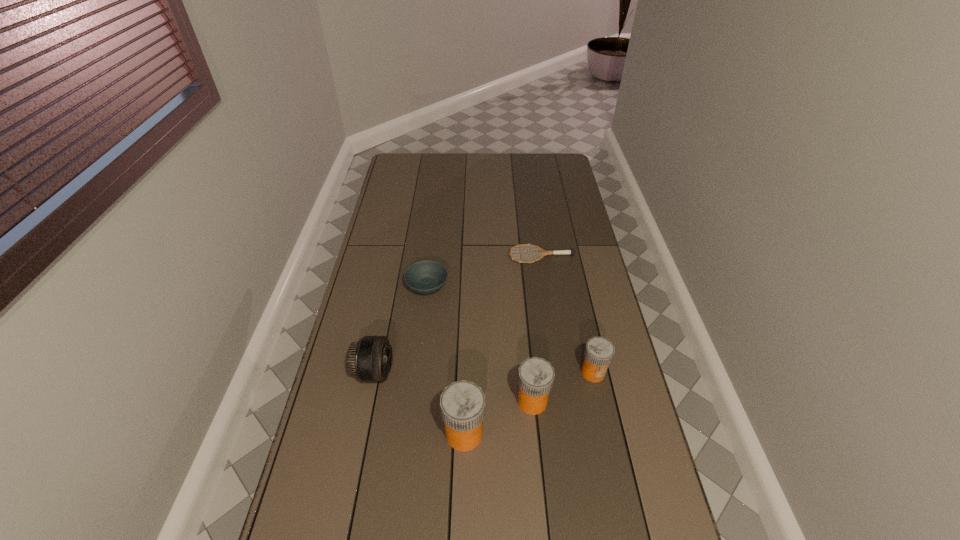
Where is `free space located on the label side of the second tallest medicine`? This screenshot has height=540, width=960. free space located on the label side of the second tallest medicine is located at coordinates (576, 401).

At what (x,y) coordinates should I click in order to perform the action: click on free space located on the label side of the rightmost medicine. Please return your answer as a coordinate pair (x, y). This screenshot has width=960, height=540. Looking at the image, I should click on (614, 469).

Locate an element on the screen. This screenshot has width=960, height=540. free region located 0.340m on the front-facing side of the telephoto lens is located at coordinates (502, 372).

Locate an element on the screen. This screenshot has height=540, width=960. free space located 0.250m on the left of the farthest object is located at coordinates (446, 256).

This screenshot has height=540, width=960. Identify the location of vacant space located on the back of the fifth tallest object. (432, 245).

The image size is (960, 540). Identify the location of object that is positioned at the left edge. click(370, 359).

The height and width of the screenshot is (540, 960). Find the location of `medicine situated at the right edge`. medicine situated at the right edge is located at coordinates (599, 351).

Locate an element on the screen. This screenshot has width=960, height=540. tennis racket that is at the right edge is located at coordinates (543, 252).

In the image, there is a desktop. Identify the location of vacant space at the far edge. (498, 167).

The height and width of the screenshot is (540, 960). I want to click on free space at the left edge of the desktop, so click(x=416, y=186).